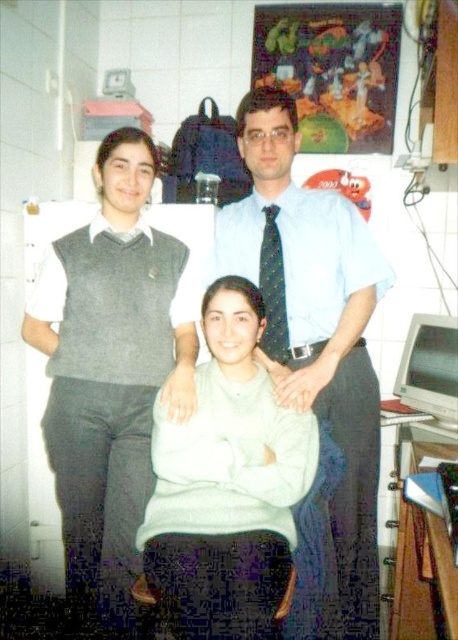
Consider the image. You are taking a photo of two points in the scene. The first point is at coordinate point (250, 486) and the second is at point (266, 252). Which point will appear larger in your photo?

Point (250, 486) is closer to the camera than point (266, 252), so it will appear larger in the photo.